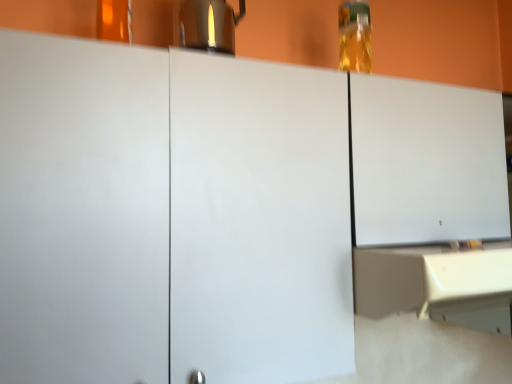
Question: Does translucent glass bottle at upper right have a greater width compared to beige matte counter at lower right?

Choices:
 (A) yes
 (B) no

Answer: (B)

Question: Is translucent glass bottle at upper right positioned beyond the bounds of beige matte counter at lower right?

Choices:
 (A) no
 (B) yes

Answer: (B)

Question: Is translucent glass bottle at upper right not near beige matte counter at lower right?

Choices:
 (A) no
 (B) yes

Answer: (A)

Question: Could you tell me if translucent glass bottle at upper right is facing beige matte counter at lower right?

Choices:
 (A) no
 (B) yes

Answer: (A)

Question: Is beige matte counter at lower right at the back of translucent glass bottle at upper right?

Choices:
 (A) no
 (B) yes

Answer: (A)

Question: Is translucent glass bottle at upper right with beige matte counter at lower right?

Choices:
 (A) yes
 (B) no

Answer: (B)

Question: Is translucent glass bottle at upper right bigger than satin silver coffee pot at upper center?

Choices:
 (A) no
 (B) yes

Answer: (A)

Question: Considering the relative sizes of translucent glass bottle at upper right and satin silver coffee pot at upper center in the image provided, is translucent glass bottle at upper right wider than satin silver coffee pot at upper center?

Choices:
 (A) no
 (B) yes

Answer: (A)

Question: Is satin silver coffee pot at upper center surrounded by translucent glass bottle at upper right?

Choices:
 (A) yes
 (B) no

Answer: (B)

Question: Would you consider translucent glass bottle at upper right to be distant from satin silver coffee pot at upper center?

Choices:
 (A) yes
 (B) no

Answer: (B)

Question: Considering the relative sizes of translucent glass bottle at upper right and satin silver coffee pot at upper center in the image provided, is translucent glass bottle at upper right shorter than satin silver coffee pot at upper center?

Choices:
 (A) yes
 (B) no

Answer: (B)

Question: Does translucent glass bottle at upper right come behind satin silver coffee pot at upper center?

Choices:
 (A) yes
 (B) no

Answer: (A)

Question: Is the position of satin silver coffee pot at upper center more distant than that of beige matte counter at lower right?

Choices:
 (A) yes
 (B) no

Answer: (A)